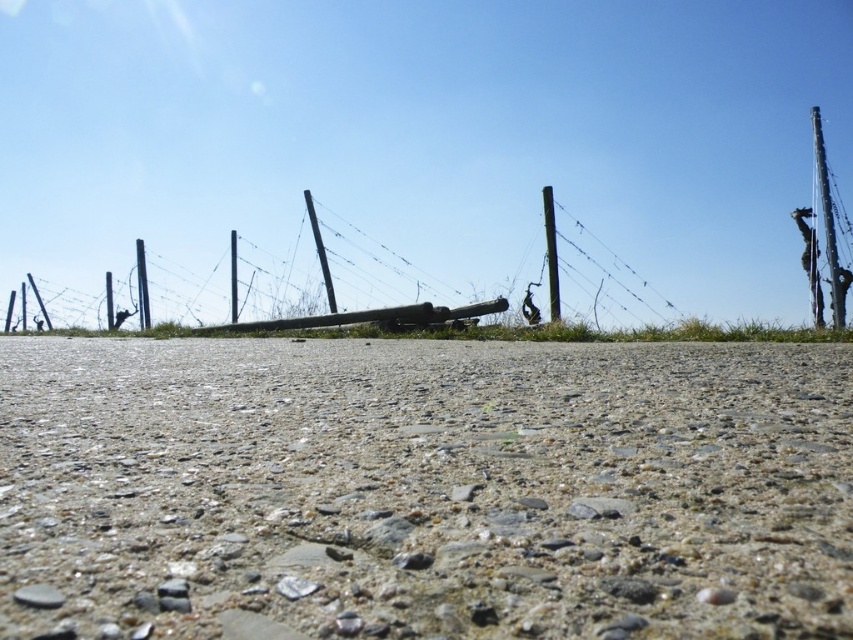
You are a delivery robot with a 2 meter wide package. You need to move from the foreground gravel to the area beyond the barbed wire fence. Can you pass between the rusty metal fence at center and the smooth black pole at center?

The rusty metal fence at center and the smooth black pole at center are 6.32 meters apart from each other. Since your package is 2 meters wide, there is sufficient space to pass through the gap between them.

In the scene shown: You are a photographer positioned at the lowest part of the gravelly surface. You want to take a photo that includes both the point at coordinates point (840,301) and point (328,269). Which point should you focus on first to ensure both are in sharp focus?

You should focus on point (328,269) first because it is farther away from the viewer than point (840,301). By focusing on the farther point, the closer point will also be within the depth of field.

You are a photographer wanting to capture the wire mesh fence at center and the smooth wooden pole at center in a single frame. Given that your camera can only focus on objects within a 10cm width range, will both objects fit within this focus range?

The wire mesh fence at center is wider than the smooth wooden pole at center. Since the camera can only focus on objects within a 10cm width range, and the difference in their widths may exceed this limit, it is possible that both objects will not fit within the focus range. However, without exact measurements, this cannot be definitively determined.